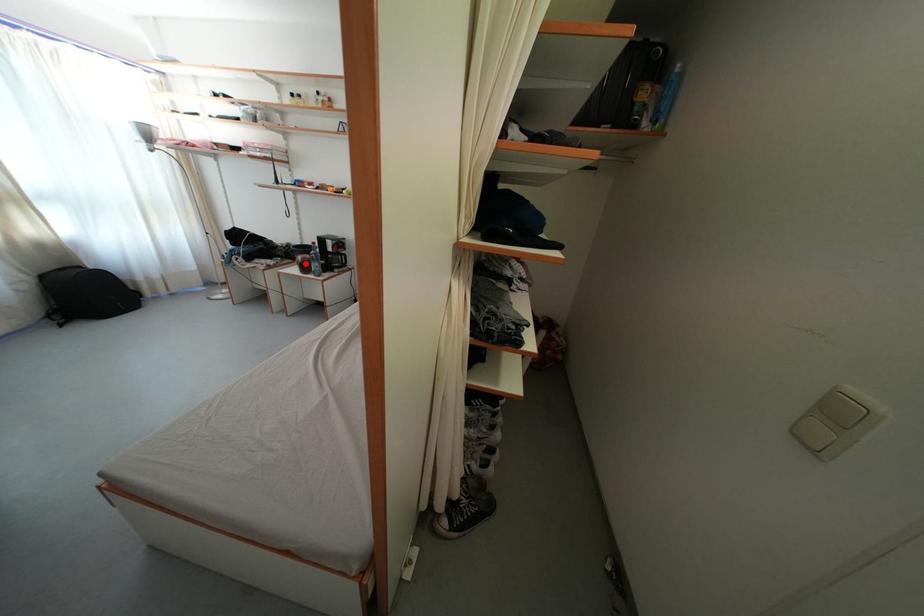
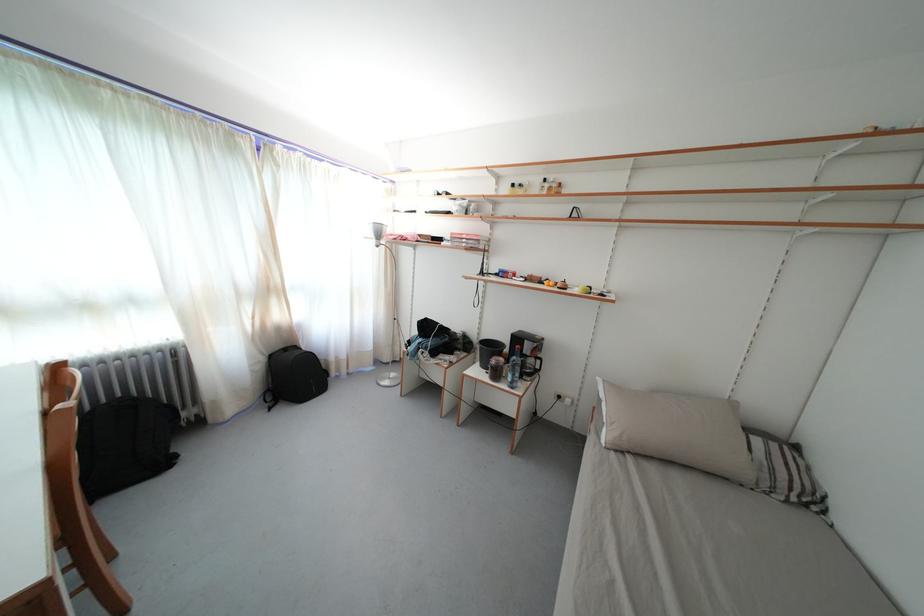
Question: I am providing you with two images of the same scene from different viewpoints. A red point is shown in image1. For the corresponding object point in image2, is it positioned nearer or farther from the camera?

Choices:
 (A) Nearer
 (B) Farther

Answer: (B)